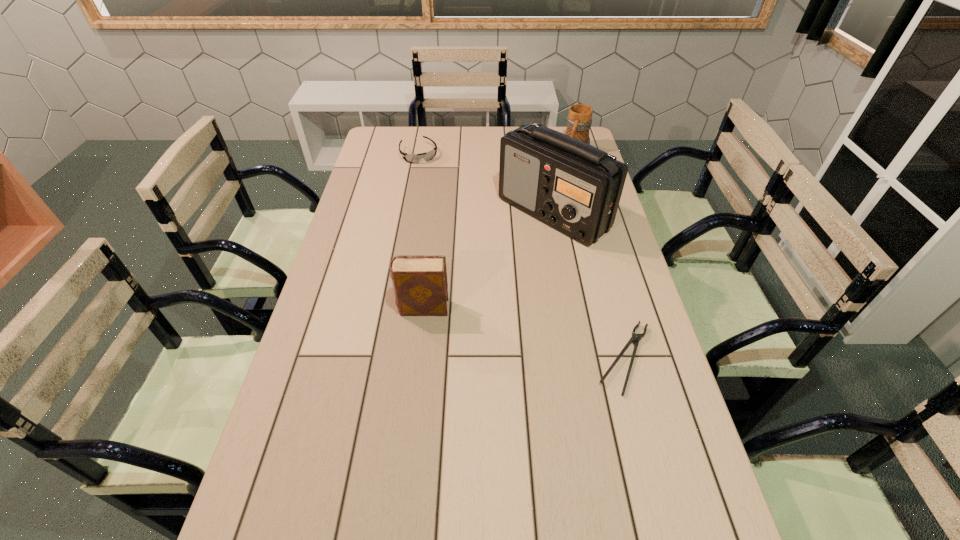
Identify the location of free location at the left edge. The height and width of the screenshot is (540, 960). (332, 427).

Locate an element on the screen. This screenshot has height=540, width=960. vacant point at the right edge is located at coordinates (x=679, y=439).

This screenshot has width=960, height=540. What are the coordinates of `free space at the near right corner of the desktop` in the screenshot? It's located at (700, 520).

This screenshot has width=960, height=540. I want to click on unoccupied position between the mug and the tongs, so (600, 255).

What are the coordinates of `blank region between the second nearest object and the tallest object` in the screenshot? It's located at (488, 261).

In order to click on vacant space in between the mug and the fourth tallest object in this screenshot , I will do `click(497, 152)`.

At what (x,y) coordinates should I click in order to perform the action: click on vacant space that's between the diary and the mug. Please return your answer as a coordinate pair (x, y). The height and width of the screenshot is (540, 960). Looking at the image, I should click on (499, 230).

The width and height of the screenshot is (960, 540). I want to click on vacant area between the diary and the mug, so click(499, 230).

Locate an element on the screen. free space that is in between the second shortest object and the mug is located at coordinates (497, 152).

You are a GUI agent. You are given a task and a screenshot of the screen. Output one action in this format:
    pyautogui.click(x=<x>, y=<y>)
    Task: Click on the free space between the nearest object and the mug
    The image size is (960, 540).
    Given the screenshot: What is the action you would take?
    pyautogui.click(x=600, y=255)